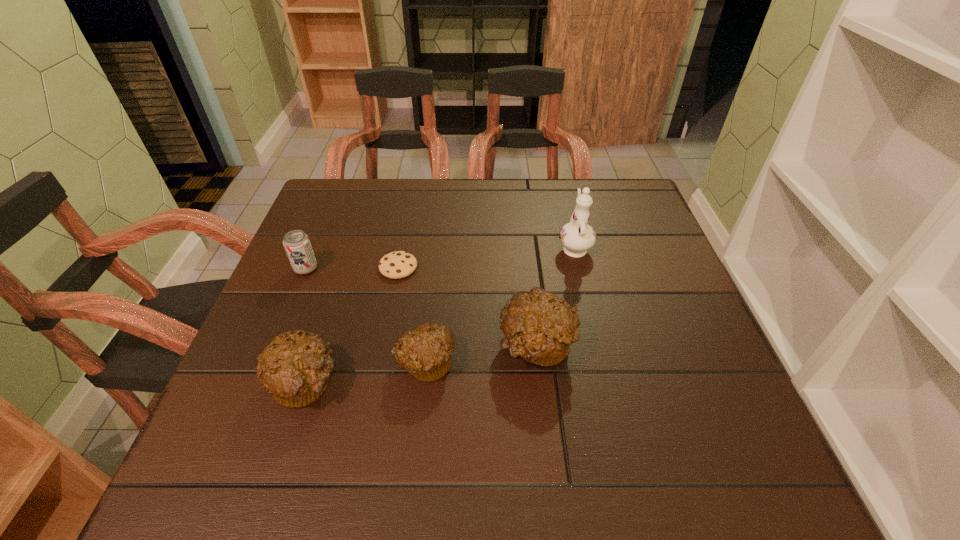
The width and height of the screenshot is (960, 540). What are the coordinates of `empty location between the beer can and the second shortest muffin` in the screenshot? It's located at coord(305,325).

In order to click on free space between the shortest muffin and the chinaware in this screenshot , I will do `click(499, 305)`.

Locate an element on the screen. Image resolution: width=960 pixels, height=540 pixels. empty space that is in between the fifth tallest object and the chinaware is located at coordinates coord(499,305).

Where is `free space between the cookie and the second tallest muffin`? The width and height of the screenshot is (960, 540). free space between the cookie and the second tallest muffin is located at coordinates (352, 325).

At what (x,y) coordinates should I click in order to perform the action: click on object that is the fifth closest one to the rightmost object. Please return your answer as a coordinate pair (x, y). Image resolution: width=960 pixels, height=540 pixels. Looking at the image, I should click on (297, 245).

Where is `the fifth closest object to the second object from right to left`? This screenshot has height=540, width=960. the fifth closest object to the second object from right to left is located at coordinates (297, 245).

Select which muffin is the third closest to the tallest object. Please provide its 2D coordinates. Your answer should be formatted as a tuple, i.e. [(x, y)], where the tuple contains the x and y coordinates of a point satisfying the conditions above.

[(295, 368)]

Locate an element on the screen. muffin that is the third nearest to the tallest object is located at coordinates (295, 368).

I want to click on vacant region that satisfies the following two spatial constraints: 1. on the front side of the rightmost muffin; 2. on the right side of the beer can, so pos(274,346).

Image resolution: width=960 pixels, height=540 pixels. Find the location of `free space that satisfies the following two spatial constraints: 1. on the front side of the beer can; 2. on the left side of the leftmost muffin`. free space that satisfies the following two spatial constraints: 1. on the front side of the beer can; 2. on the left side of the leftmost muffin is located at coordinates 259,382.